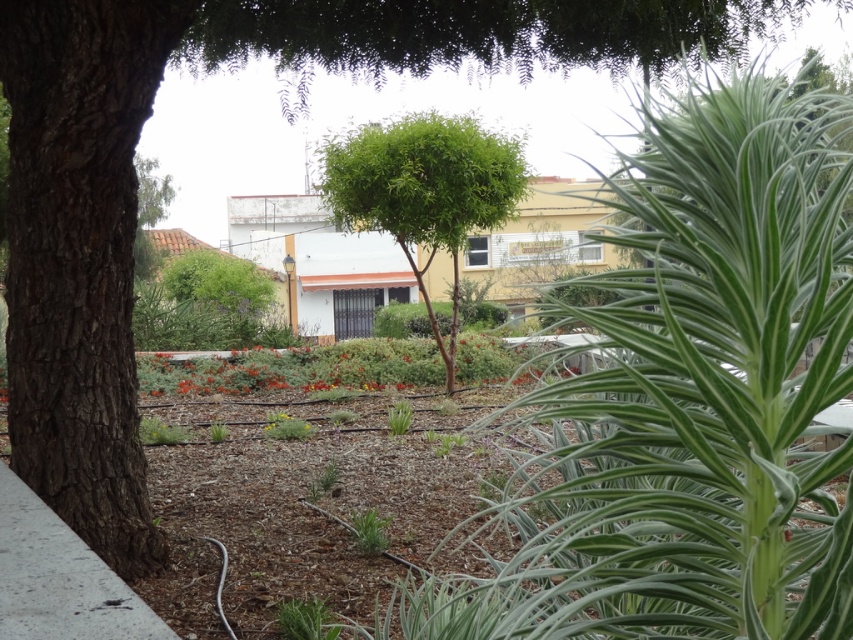
Consider the image. You are a gardener planning to install a new sprinkler system. The green leafy tree at center needs to be watered, but you want to avoid getting the gray concrete pavement at lower left too wet. Based on their positions, where should you place the sprinkler to water the tree without soaking the pavement?

Since the green leafy tree at center is positioned over the gray concrete pavement at lower left, placing the sprinkler directly under the tree would water it while minimizing water reaching the pavement below.

You are standing on the gray concrete pavement at lower left and want to walk towards the green leafy tree at center. In which direction should you head?

You should head to the right because the green leafy tree at center is located to the right of the gray concrete pavement at lower left.

You are standing in the shaded area under the tree and want to take a photo of the green leafy tree at center. Where should you position yourself relative to the point marked as point (424,193) to capture the entire tree in your camera frame?

The green leafy tree at center is represented by point (424,193). To capture the entire tree in your camera frame, you should position yourself directly at point (424,193) as that is the central point marking the tree.